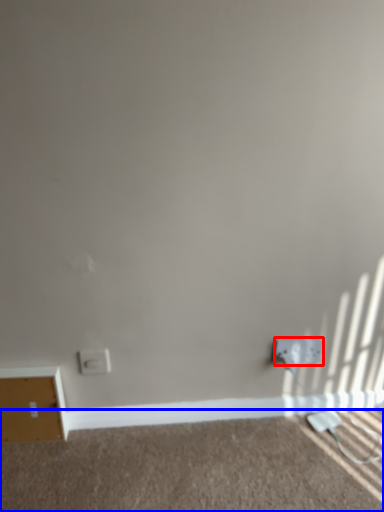
Question: Which of the following is the closest to the observer, power plugs and sockets (highlighted by a red box) or plain (highlighted by a blue box)?

Choices:
 (A) power plugs and sockets
 (B) plain

Answer: (B)